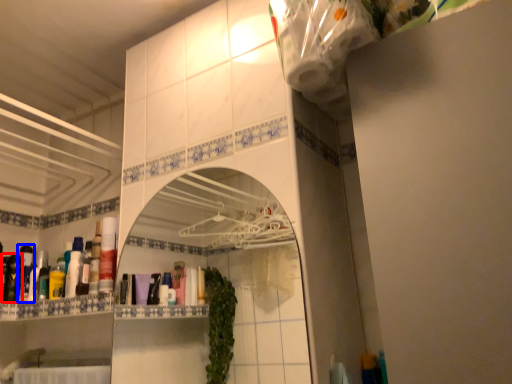
Question: Which object is further to the camera taking this photo, toiletry (highlighted by a red box) or toiletry (highlighted by a blue box)?

Choices:
 (A) toiletry
 (B) toiletry

Answer: (B)